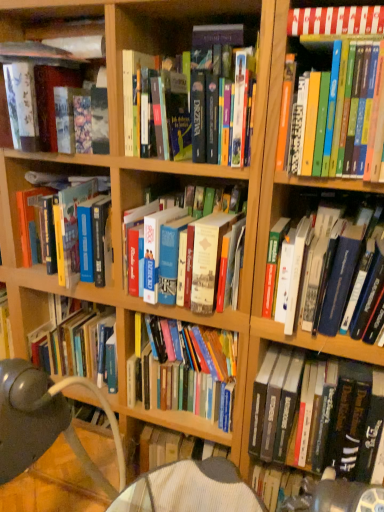
Question: Is hardcover book at center, marked as the seventh book in a bottom-to-top arrangement, wider or thinner than hardcover book at center, which is the 9th book in top-to-bottom order?

Choices:
 (A) wide
 (B) thin

Answer: (B)

Question: From the image's perspective, is hardcover book at center, marked as the seventh book in a bottom-to-top arrangement, located above or below hardcover book at center, which is counted as the 1th book, starting from the bottom?

Choices:
 (A) above
 (B) below

Answer: (A)

Question: Which object is positioned closest to the hardcover books at upper right, acting as the fourth book starting from the top?

Choices:
 (A) hardcover book at center, which is the eighth book in top-to-bottom order
 (B) matte black book at upper left, which ranks as the 8th book in bottom-to-top order
 (C) hardcover book at center, which is the 9th book in top-to-bottom order
 (D) white paper book at upper right, positioned as the 1th book in top-to-bottom order
 (E) hardcover book at center, the 5th book when ordered from bottom to top

Answer: (D)

Question: Considering the real-world distances, which object is closest to the hardcover book at center, the third book in the bottom-to-top sequence?

Choices:
 (A) hardcover books at upper right, acting as the fourth book starting from the top
 (B) white paper book at upper right, arranged as the 9th book when ordered from the bottom
 (C) hardcover books at center, the 6th book viewed from the top
 (D) matte black book at upper left, which is counted as the 2th book, starting from the top
 (E) hardcover book at center, the 5th book when ordered from bottom to top

Answer: (A)